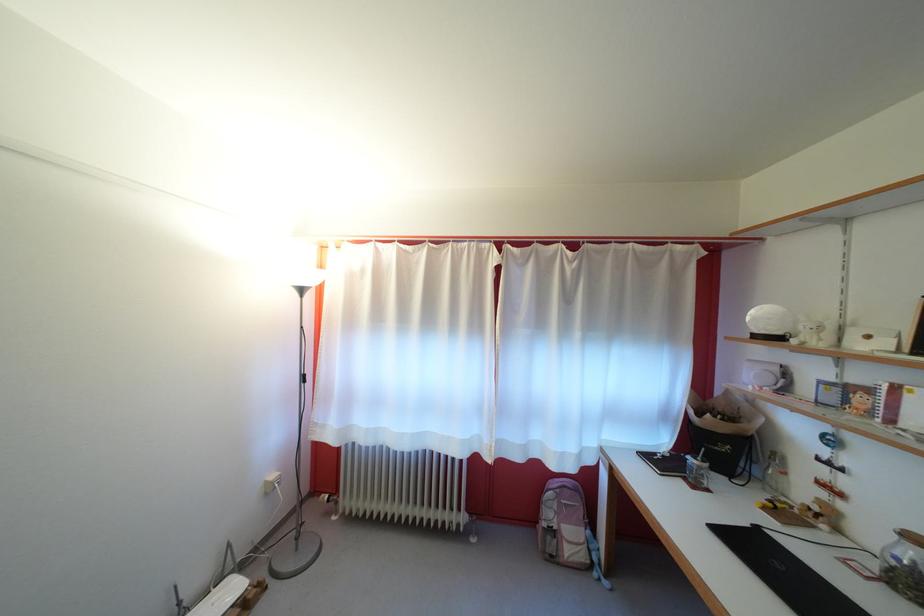
The width and height of the screenshot is (924, 616). I want to click on white mug handle, so click(x=708, y=483).